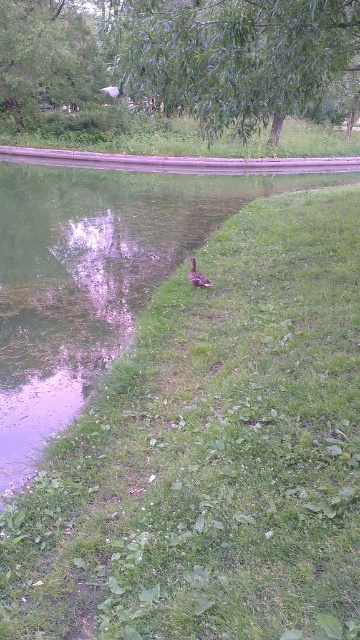
You are standing on the grassy bank where the duck is located. Looking towards the water, you notice a point marked at coordinates (232, 56). What object in the scene does this point most likely indicate?

The point at coordinates (232, 56) corresponds to the green leafy tree at upper center.

From the picture: You are a bird flying over the pond. You see the green leafy tree at upper center and the brown matte duck at center. Which object would block your view if you try to look down at the duck?

The green leafy tree at upper center is in front of the brown matte duck at center, so it would block your view of the duck when looking down.